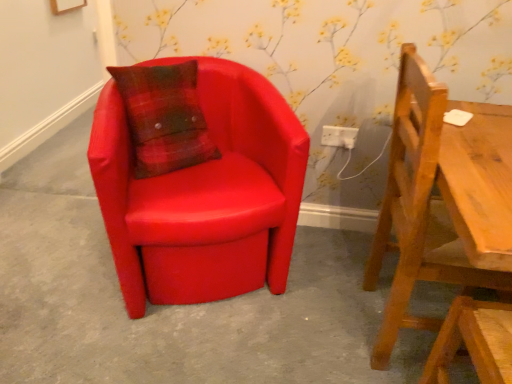
Where is `free point in front of matte leather chair at left, the second chair viewed from the right`? The width and height of the screenshot is (512, 384). free point in front of matte leather chair at left, the second chair viewed from the right is located at coordinates (177, 348).